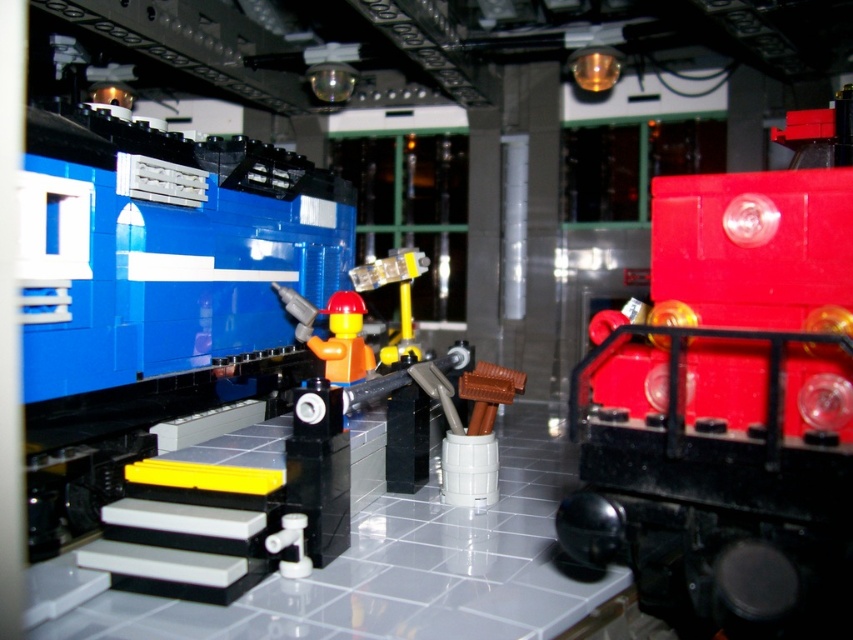
Which is in front, point (445, 445) or point (346, 332)?

Point (445, 445)

Is brown plastic cup at center positioned behind yellow matte figure at center?

That is False.

Is point (479, 413) behind point (331, 336)?

No, it is not.

Where is `brown plastic cup at center`? The height and width of the screenshot is (640, 853). brown plastic cup at center is located at coordinates (469, 428).

Is shiny red train at right positioned before brown plastic cup at center?

That is True.

Does shiny red train at right lie behind brown plastic cup at center?

No.

Identify the location of shiny red train at right. (728, 406).

Identify the location of shiny red train at right. (728, 406).

Looking at this image, does brown plastic cup at center appear over translucent yellow plastic at center?

No, brown plastic cup at center is not above translucent yellow plastic at center.

You are a GUI agent. You are given a task and a screenshot of the screen. Output one action in this format:
    pyautogui.click(x=<x>, y=<y>)
    Task: Click on the brown plastic cup at center
    
    Given the screenshot: What is the action you would take?
    pyautogui.click(x=469, y=428)